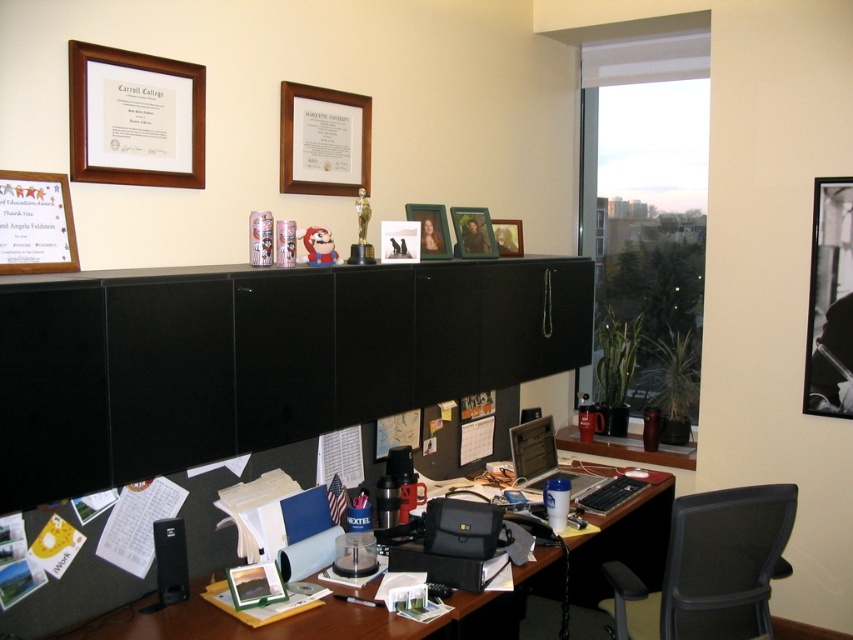
You are organizing the desk and want to place a new item between the wooden picture frame at upper left and the matte paper certificate at upper left. Is there enough space between them to fit a standard notebook?

The wooden picture frame at upper left is to the right of the matte paper certificate at upper left, so there is space between them. A standard notebook should fit between them.

You are standing in the home office and need to locate the wooden framed certificate at upper center. According to the coordinates provided, where exactly is it positioned?

The wooden framed certificate at upper center is located at the coordinates point (323, 140).